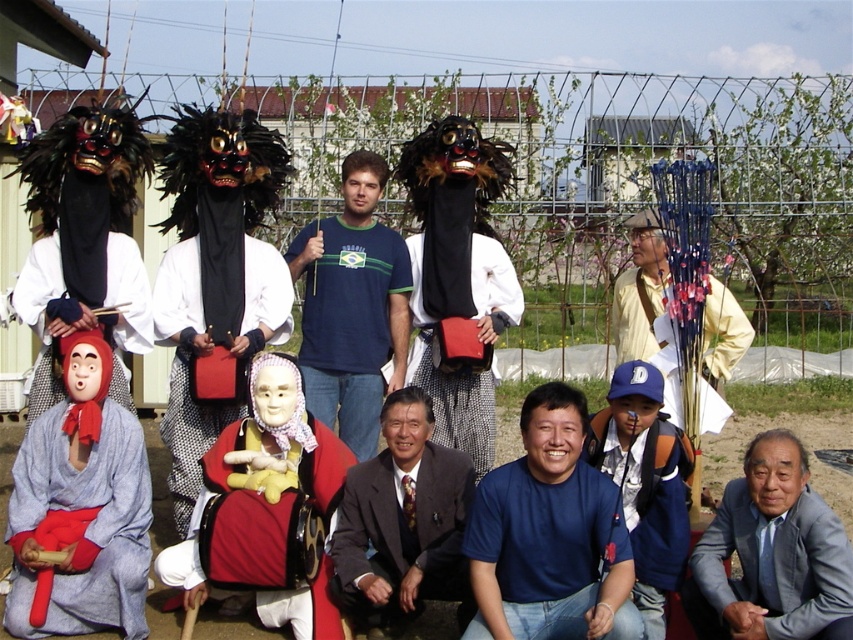
Question: Can you confirm if matte red fabric mask at center is positioned to the right of blue fabric mask at lower center?

Choices:
 (A) yes
 (B) no

Answer: (B)

Question: Among these objects, which one is nearest to the camera?

Choices:
 (A) blue cotton kimono at lower left
 (B) blue cotton t-shirt at center
 (C) dark brown suit at center
 (D) gray suit at lower right

Answer: (D)

Question: Is matte red mask at lower left bigger than velvet red costume at center?

Choices:
 (A) yes
 (B) no

Answer: (A)

Question: In this image, where is light beige cotton shirt at right located relative to velvet red costume at center?

Choices:
 (A) right
 (B) left

Answer: (A)

Question: Among these objects, which one is nearest to the camera?

Choices:
 (A) black matte bag at center
 (B) gray suit at lower right
 (C) dark brown suit at center

Answer: (B)

Question: Which of the following is the farthest from the observer?

Choices:
 (A) blue cotton kimono at lower left
 (B) black matte bag at center
 (C) dark brown suit at center
 (D) blue cotton shirt at lower center

Answer: (B)